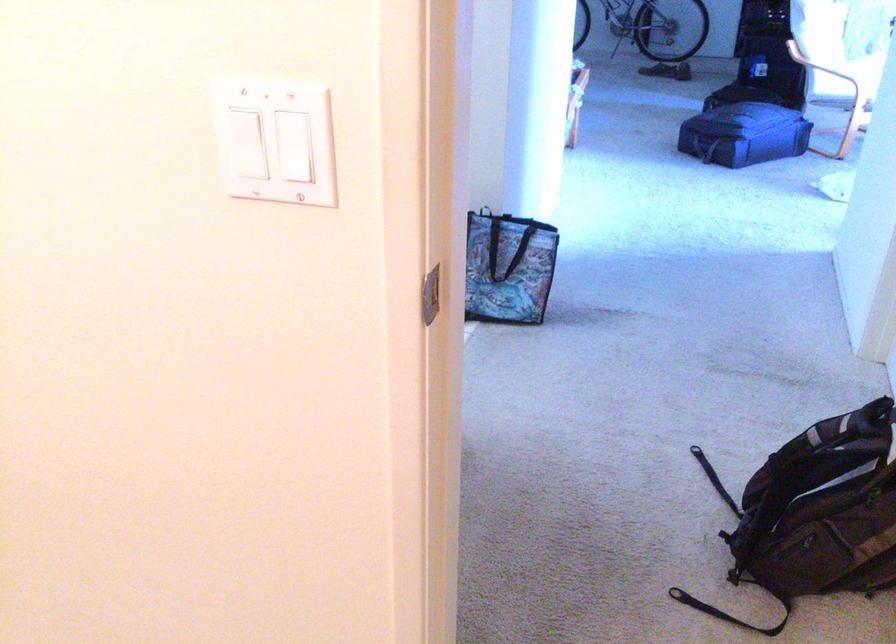
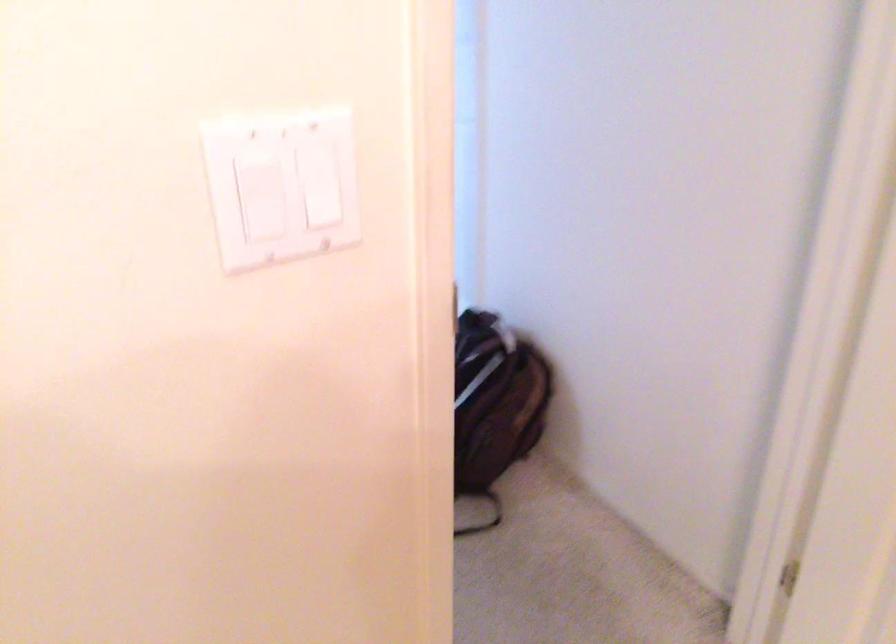
Locate, in the second image, the point that corresponds to (x=279, y=127) in the first image.

(326, 192)